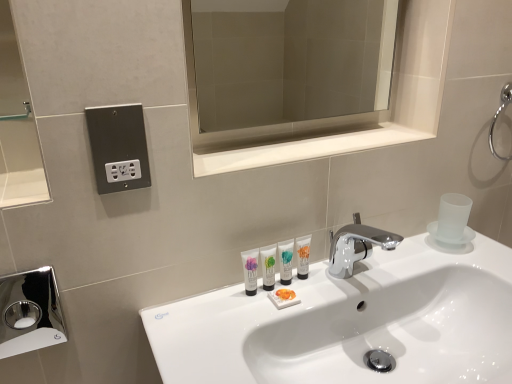
In order to face white glossy tube at center, positioned as the first mouthwash in right-to-left order, should I rotate leftwards or rightwards?

Rotate your view right by about 6.529°.

You are a GUI agent. You are given a task and a screenshot of the screen. Output one action in this format:
    pyautogui.click(x=<x>, y=<y>)
    Task: Click on the metallic outlet at upper left
    The image size is (512, 384).
    Given the screenshot: What is the action you would take?
    pyautogui.click(x=118, y=147)

The width and height of the screenshot is (512, 384). What do you see at coordinates (118, 147) in the screenshot?
I see `metallic outlet at upper left` at bounding box center [118, 147].

Measure the distance between point (252, 291) and camera.

They are 33.19 inches apart.

How much space does white glossy tube at center, marked as the second mouthwash in a left-to-right arrangement, occupy vertically?

The height of white glossy tube at center, marked as the second mouthwash in a left-to-right arrangement, is 3.87 inches.

Describe the element at coordinates (344, 116) in the screenshot. I see `clear glass mirror at upper center` at that location.

The height and width of the screenshot is (384, 512). Identify the location of white glossy tube at center, which ranks as the fourth mouthwash in left-to-right order. (303, 256).

From a real-world perspective, is white glossy tube at center, the third mouthwash when ordered from right to left, positioned under white glossy tube at center, which is counted as the second mouthwash, starting from the right, based on gravity?

Yes, from a real-world perspective, white glossy tube at center, the third mouthwash when ordered from right to left, is beneath white glossy tube at center, which is counted as the second mouthwash, starting from the right.

Are white glossy tube at center, marked as the second mouthwash in a left-to-right arrangement, and white glossy tube at center, the 3th mouthwash in the left-to-right sequence, beside each other?

Indeed, white glossy tube at center, marked as the second mouthwash in a left-to-right arrangement, and white glossy tube at center, the 3th mouthwash in the left-to-right sequence, are beside each other and touching.

Who is shorter, white glossy tube at center, marked as the second mouthwash in a left-to-right arrangement, or white glossy tube at center, the 3th mouthwash in the left-to-right sequence?

white glossy tube at center, marked as the second mouthwash in a left-to-right arrangement, is shorter.

Locate an element on the screen. mouthwash that is the 1st object to the right of the white glossy tube at center, marked as the second mouthwash in a left-to-right arrangement, starting at the anchor is located at coordinates (286, 261).

In the image, is white glossy tube at center, which ranks as the fourth mouthwash in left-to-right order, positioned in front of or behind polished chrome hand dryer at lower left?

Visually, white glossy tube at center, which ranks as the fourth mouthwash in left-to-right order, is located behind polished chrome hand dryer at lower left.

Is white glossy tube at center, which ranks as the fourth mouthwash in left-to-right order, spatially inside polished chrome hand dryer at lower left, or outside of it?

white glossy tube at center, which ranks as the fourth mouthwash in left-to-right order, exists outside the volume of polished chrome hand dryer at lower left.

Locate an element on the screen. This screenshot has width=512, height=384. hand dryer above the white glossy tube at center, positioned as the first mouthwash in right-to-left order (from a real-world perspective) is located at coordinates (30, 312).

From a real-world perspective, which is physically below, white glossy tube at center, positioned as the first mouthwash in right-to-left order, or polished chrome hand dryer at lower left?

white glossy tube at center, positioned as the first mouthwash in right-to-left order, from a real-world perspective.

How different are the orientations of polished chrome hand dryer at lower left and white glossy tube at center, acting as the 4th mouthwash starting from the right, in degrees?

polished chrome hand dryer at lower left and white glossy tube at center, acting as the 4th mouthwash starting from the right, are facing 3.71 degrees away from each other.

Is polished chrome hand dryer at lower left far away from white glossy tube at center, the first mouthwash in the left-to-right sequence?

polished chrome hand dryer at lower left is far away from white glossy tube at center, the first mouthwash in the left-to-right sequence.

Looking at this image, from the image's perspective, which one is positioned lower, polished chrome hand dryer at lower left or white glossy tube at center, acting as the 4th mouthwash starting from the right?

polished chrome hand dryer at lower left appears lower in the image.

Who is bigger, polished chrome hand dryer at lower left or white glossy tube at center, the first mouthwash in the left-to-right sequence?

polished chrome hand dryer at lower left.

How many degrees apart are the facing directions of white glossy tube at center, the first mouthwash in the left-to-right sequence, and clear glass mirror at upper center?

4.67 degrees separate the facing orientations of white glossy tube at center, the first mouthwash in the left-to-right sequence, and clear glass mirror at upper center.

Consider the image. From a real-world perspective, is white glossy tube at center, acting as the 4th mouthwash starting from the right, on top of clear glass mirror at upper center?

No, from a real-world perspective, white glossy tube at center, acting as the 4th mouthwash starting from the right, is not on top of clear glass mirror at upper center.

Image resolution: width=512 pixels, height=384 pixels. I want to click on medicine cabinet above the white glossy tube at center, the first mouthwash in the left-to-right sequence (from the image's perspective), so click(344, 116).

Which of these two, white glossy tube at center, the first mouthwash in the left-to-right sequence, or clear glass mirror at upper center, is wider?

white glossy tube at center, the first mouthwash in the left-to-right sequence.

Consider the image. Is white glossy sink at center far from polished chrome hand dryer at lower left?

Yes, white glossy sink at center and polished chrome hand dryer at lower left are located far from each other.

Is polished chrome hand dryer at lower left completely or partially inside white glossy sink at center?

No.

Between white glossy sink at center and polished chrome hand dryer at lower left, which one has smaller size?

polished chrome hand dryer at lower left is smaller.

Which object is more forward, white glossy sink at center or polished chrome hand dryer at lower left?

white glossy sink at center is closer to the camera.

Considering the relative positions of white glossy sink at center and clear glass mirror at upper center in the image provided, is white glossy sink at center to the right of clear glass mirror at upper center from the viewer's perspective?

Correct, you'll find white glossy sink at center to the right of clear glass mirror at upper center.

Considering the sizes of white glossy sink at center and clear glass mirror at upper center in the image, is white glossy sink at center wider or thinner than clear glass mirror at upper center?

Considering their sizes, white glossy sink at center looks broader than clear glass mirror at upper center.

Is point (298, 364) closer or farther from the camera than point (426, 45)?

Clearly, point (298, 364) is closer to the camera than point (426, 45).

Would you say clear glass mirror at upper center is part of white glossy sink at center's contents?

Definitely not — clear glass mirror at upper center is not inside white glossy sink at center.

Between white glossy sink at center and white glossy tube at center, the 3th mouthwash in the left-to-right sequence, which one has larger size?

white glossy sink at center is bigger.

Between white glossy sink at center and white glossy tube at center, the 3th mouthwash in the left-to-right sequence, which one is positioned in front?

white glossy sink at center.

Is white glossy tube at center, the 3th mouthwash in the left-to-right sequence, at the back of white glossy sink at center?

That's not correct — white glossy sink at center is not looking away from white glossy tube at center, the 3th mouthwash in the left-to-right sequence.

Where is `sink in front of the white glossy tube at center, which is counted as the second mouthwash, starting from the right`? This screenshot has height=384, width=512. sink in front of the white glossy tube at center, which is counted as the second mouthwash, starting from the right is located at coordinates (351, 323).

Where is `the 1st mouthwash directly above the white glossy tube at center, the third mouthwash when ordered from right to left (from a real-world perspective)`? The image size is (512, 384). the 1st mouthwash directly above the white glossy tube at center, the third mouthwash when ordered from right to left (from a real-world perspective) is located at coordinates (286, 261).

Locate an element on the screen. The width and height of the screenshot is (512, 384). hand dryer on the left of the white glossy tube at center, which ranks as the fourth mouthwash in left-to-right order is located at coordinates (30, 312).

Looking at the image, which one is located further to metallic outlet at upper left, polished chrome hand dryer at lower left or white glossy tube at center, acting as the 4th mouthwash starting from the right?

polished chrome hand dryer at lower left lies further to metallic outlet at upper left than the other object.

From the image, which object appears to be nearer to white glossy tube at center, the third mouthwash when ordered from right to left, white glossy tube at center, which is counted as the second mouthwash, starting from the right, or clear glass mirror at upper center?

The object closer to white glossy tube at center, the third mouthwash when ordered from right to left, is white glossy tube at center, which is counted as the second mouthwash, starting from the right.

When comparing their distances from metallic outlet at upper left, does white glossy tube at center, which is counted as the second mouthwash, starting from the right, or white glossy tube at center, which ranks as the fourth mouthwash in left-to-right order, seem further?

white glossy tube at center, which ranks as the fourth mouthwash in left-to-right order, is positioned further to the anchor metallic outlet at upper left.

Estimate the real-world distances between objects in this image. Which object is further from clear glass mirror at upper center, white glossy tube at center, the third mouthwash when ordered from right to left, or white glossy sink at center?

The object further to clear glass mirror at upper center is white glossy tube at center, the third mouthwash when ordered from right to left.

From the picture: When comparing their distances from white glossy tube at center, which is counted as the second mouthwash, starting from the right, does white glossy tube at center, marked as the second mouthwash in a left-to-right arrangement, or white glossy sink at center seem further?

Among the two, white glossy sink at center is located further to white glossy tube at center, which is counted as the second mouthwash, starting from the right.

Based on their spatial positions, is white glossy tube at center, acting as the 4th mouthwash starting from the right, or white glossy sink at center closer to white glossy tube at center, marked as the second mouthwash in a left-to-right arrangement?

Based on the image, white glossy tube at center, acting as the 4th mouthwash starting from the right, appears to be nearer to white glossy tube at center, marked as the second mouthwash in a left-to-right arrangement.

Based on their spatial positions, is white glossy tube at center, the first mouthwash in the left-to-right sequence, or white glossy tube at center, which is counted as the second mouthwash, starting from the right, closer to white glossy tube at center, the third mouthwash when ordered from right to left?

white glossy tube at center, the first mouthwash in the left-to-right sequence, lies closer to white glossy tube at center, the third mouthwash when ordered from right to left, than the other object.

From the image, which object appears to be farther from white glossy tube at center, which is counted as the second mouthwash, starting from the right, white glossy sink at center or white glossy tube at center, acting as the 4th mouthwash starting from the right?

white glossy sink at center is positioned further to the anchor white glossy tube at center, which is counted as the second mouthwash, starting from the right.

The height and width of the screenshot is (384, 512). What are the coordinates of `mouthwash between white glossy tube at center, acting as the 4th mouthwash starting from the right, and white glossy tube at center, the 3th mouthwash in the left-to-right sequence, in the horizontal direction` in the screenshot? It's located at (268, 266).

Identify the location of electric outlet between clear glass mirror at upper center and white glossy sink at center vertically. (118, 147).

Find the location of a particular element. The width and height of the screenshot is (512, 384). electric outlet situated between polished chrome hand dryer at lower left and white glossy tube at center, marked as the second mouthwash in a left-to-right arrangement, from left to right is located at coordinates pos(118,147).

What are the coordinates of `electric outlet situated between polished chrome hand dryer at lower left and white glossy tube at center, which ranks as the fourth mouthwash in left-to-right order, from left to right` in the screenshot? It's located at pos(118,147).